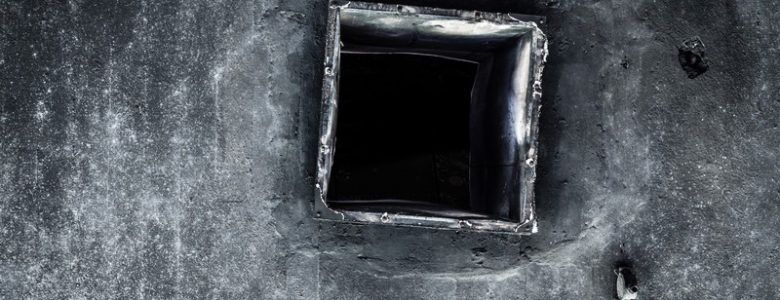
The image size is (780, 300). I want to click on wall next to opening, so click(402, 231), click(558, 152), click(298, 83), click(452, 5).